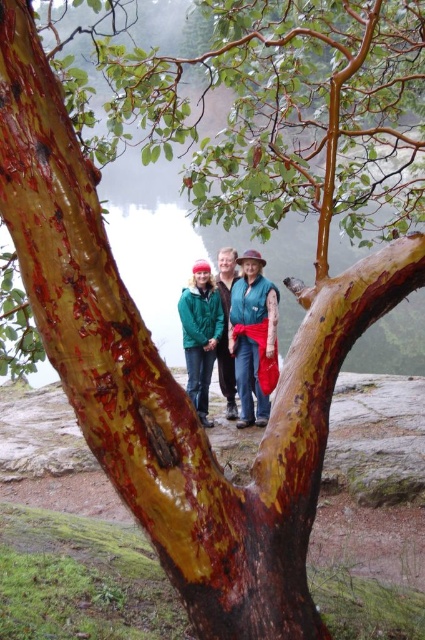
Question: Is teal fabric vest at center smaller than green matte jacket at center?

Choices:
 (A) yes
 (B) no

Answer: (B)

Question: Can you confirm if green fleece jacket at center is smaller than green matte jacket at center?

Choices:
 (A) yes
 (B) no

Answer: (B)

Question: Is teal fabric vest at center thinner than green matte jacket at center?

Choices:
 (A) yes
 (B) no

Answer: (B)

Question: Among these objects, which one is farthest from the camera?

Choices:
 (A) teal fabric vest at center
 (B) green fleece jacket at center
 (C) green matte jacket at center

Answer: (C)

Question: Among these objects, which one is farthest from the camera?

Choices:
 (A) teal fabric vest at center
 (B) green matte jacket at center

Answer: (B)

Question: Which object is closer to the camera taking this photo?

Choices:
 (A) teal fabric vest at center
 (B) green fleece jacket at center

Answer: (B)